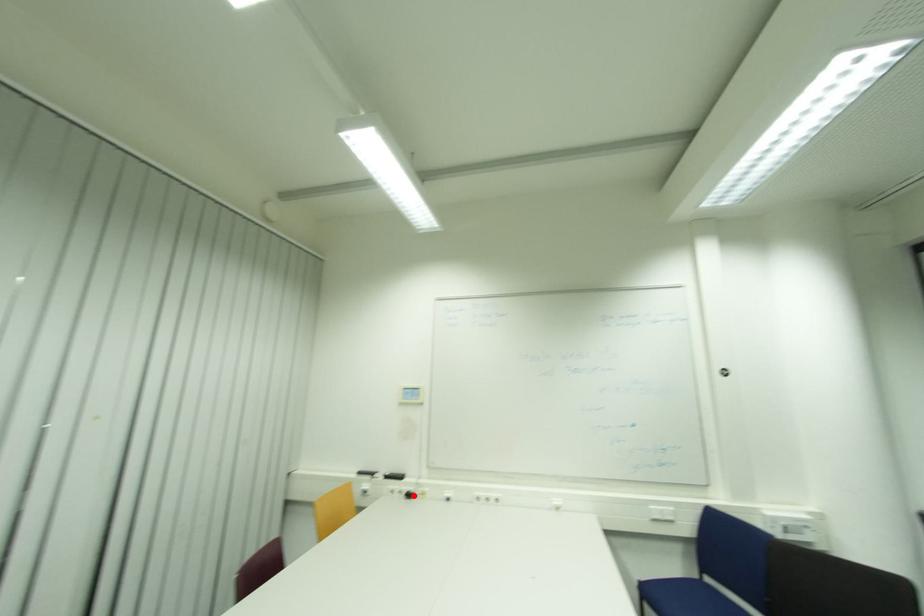
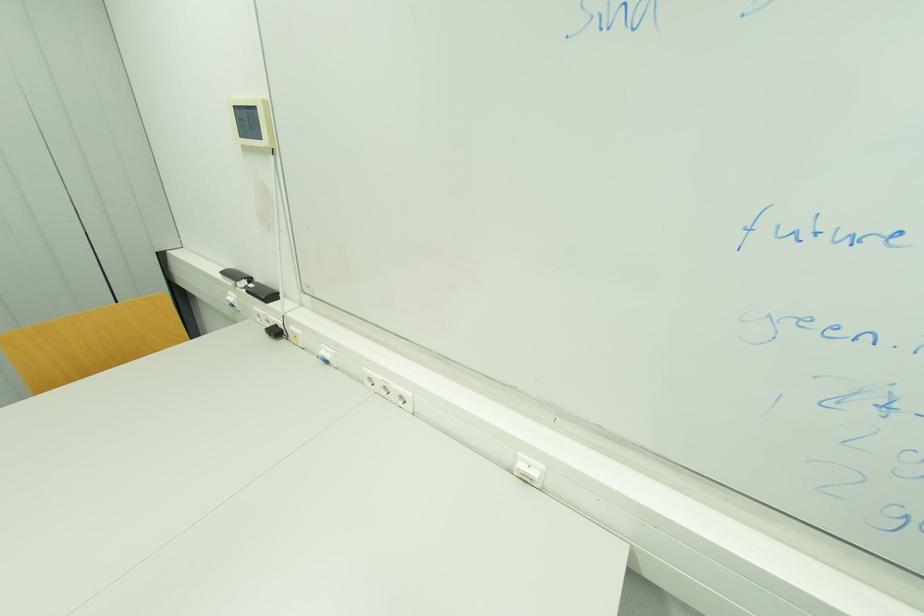
Question: A red point is marked in image1. In image2, is the corresponding 3D point closer to the camera or farther? Reply with the corresponding letter.

Choices:
 (A) The corresponding 3D point is closer.
 (B) The corresponding 3D point is farther.

Answer: (A)